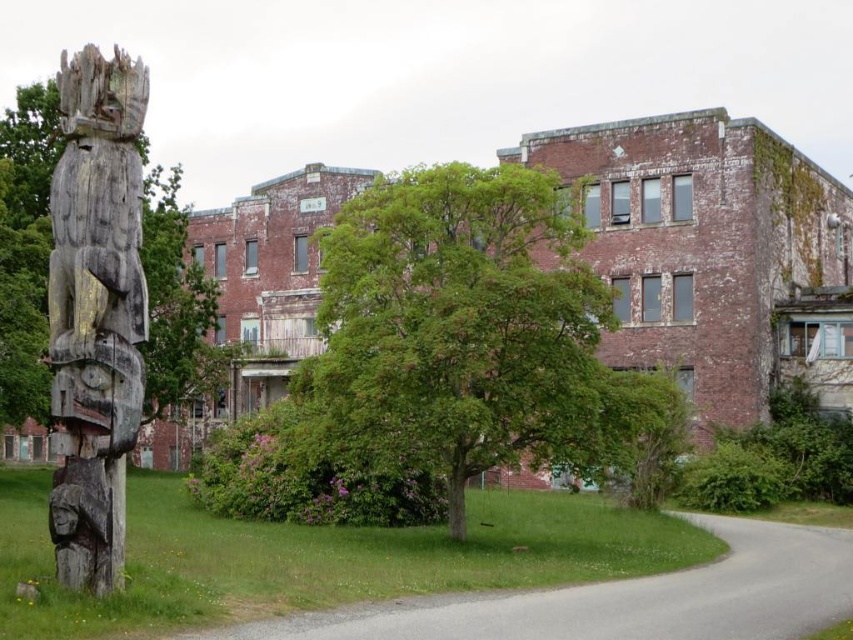
Question: Observing the image, what is the correct spatial positioning of green leafy tree at center in reference to green rough bark tree at center?

Choices:
 (A) below
 (B) above

Answer: (A)

Question: Which of the following is the farthest from the observer?

Choices:
 (A) weathered wood totem pole at left
 (B) green rough bark tree at center
 (C) green leafy tree at center

Answer: (C)

Question: Estimate the real-world distances between objects in this image. Which object is closer to the weathered wood totem pole at left?

Choices:
 (A) green leafy tree at center
 (B) green rough bark tree at center

Answer: (B)

Question: Is green leafy tree at center thinner than green rough bark tree at center?

Choices:
 (A) no
 (B) yes

Answer: (B)

Question: Which object is positioned farthest from the green rough bark tree at center?

Choices:
 (A) green leafy tree at center
 (B) weathered wood totem pole at left

Answer: (A)

Question: Does green leafy tree at center have a smaller size compared to weathered wood totem pole at left?

Choices:
 (A) yes
 (B) no

Answer: (A)